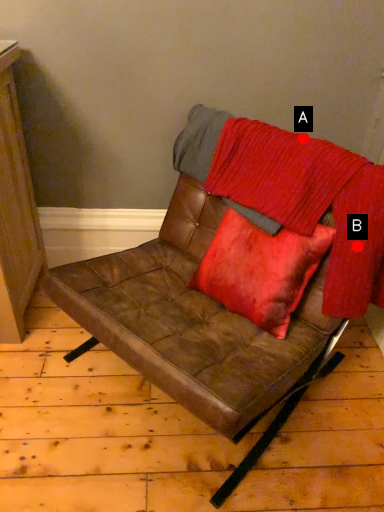
Question: Two points are circled on the image, labeled by A and B beside each circle. Which point is closer to the camera?

Choices:
 (A) A is closer
 (B) B is closer

Answer: (B)